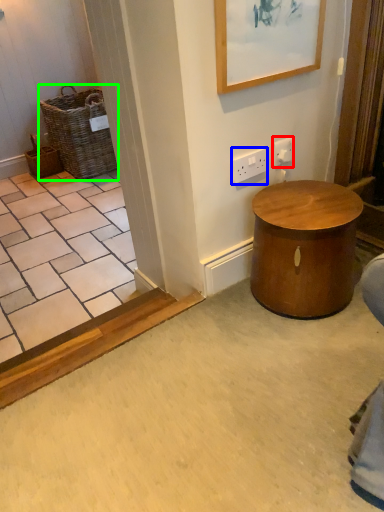
Question: Which is nearer to the electric outlet (highlighted by a red box)? electric outlet (highlighted by a blue box) or basket (highlighted by a green box).

Choices:
 (A) electric outlet
 (B) basket

Answer: (A)